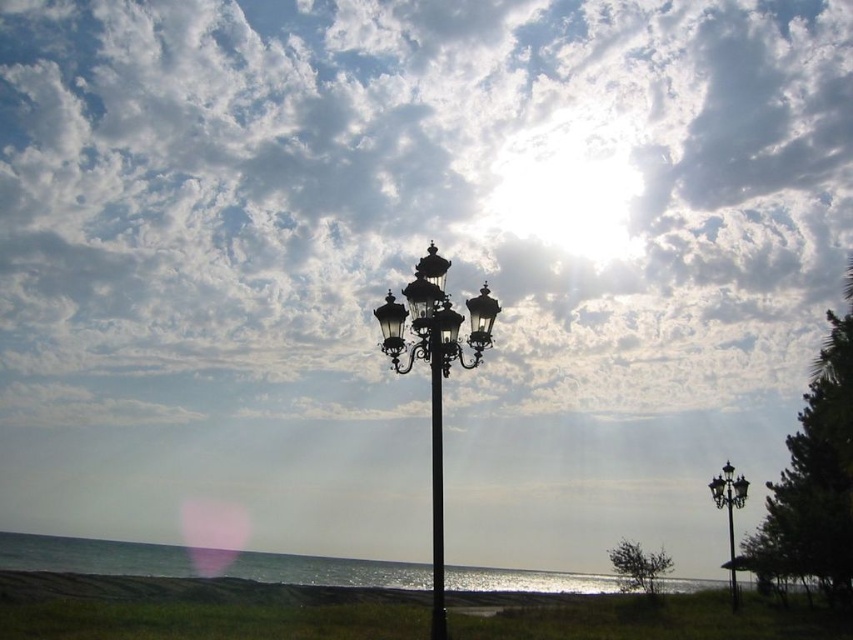
Between blue water at lower center and black polished metal pole at center, which one appears on the right side from the viewer's perspective?

Positioned to the right is black polished metal pole at center.

Is blue water at lower center to the left of black polished metal pole at center from the viewer's perspective?

Correct, you'll find blue water at lower center to the left of black polished metal pole at center.

You are a GUI agent. You are given a task and a screenshot of the screen. Output one action in this format:
    pyautogui.click(x=<x>, y=<y>)
    Task: Click on the blue water at lower center
    This screenshot has width=853, height=640.
    Given the screenshot: What is the action you would take?
    pyautogui.click(x=201, y=563)

Does point (799, 589) come closer to viewer compared to point (728, 477)?

No, (799, 589) is further to viewer.

Does point (410, 570) come closer to viewer compared to point (741, 486)?

No, (410, 570) is further to viewer.

Find the location of `blue water at lower center`. blue water at lower center is located at coordinates (201, 563).

Does green grass at lower center appear on the left side of black metal streetlight at center?

Indeed, green grass at lower center is positioned on the left side of black metal streetlight at center.

In the scene shown: Who is positioned more to the right, green grass at lower center or black metal streetlight at center?

black metal streetlight at center is more to the right.

Find the location of a particular element. This screenshot has height=640, width=853. green grass at lower center is located at coordinates (200, 609).

At what (x,y) coordinates should I click in order to perform the action: click on green grass at lower center. Please return your answer as a coordinate pair (x, y). This screenshot has height=640, width=853. Looking at the image, I should click on (200, 609).